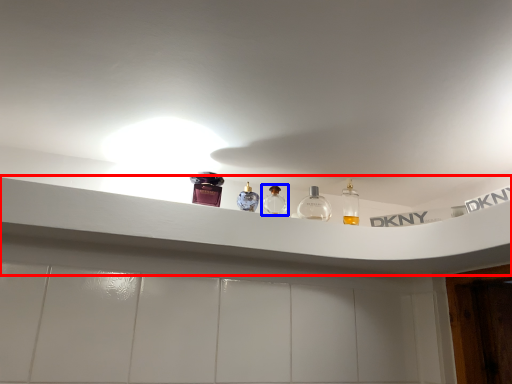
Question: Which of the following is the closest to the observer, window sill (highlighted by a red box) or bottle (highlighted by a blue box)?

Choices:
 (A) window sill
 (B) bottle

Answer: (A)